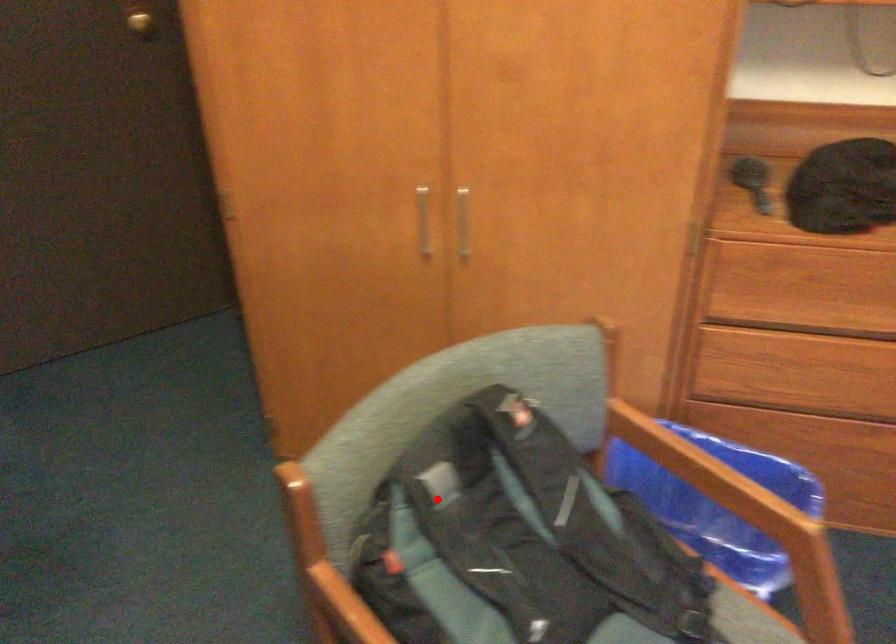
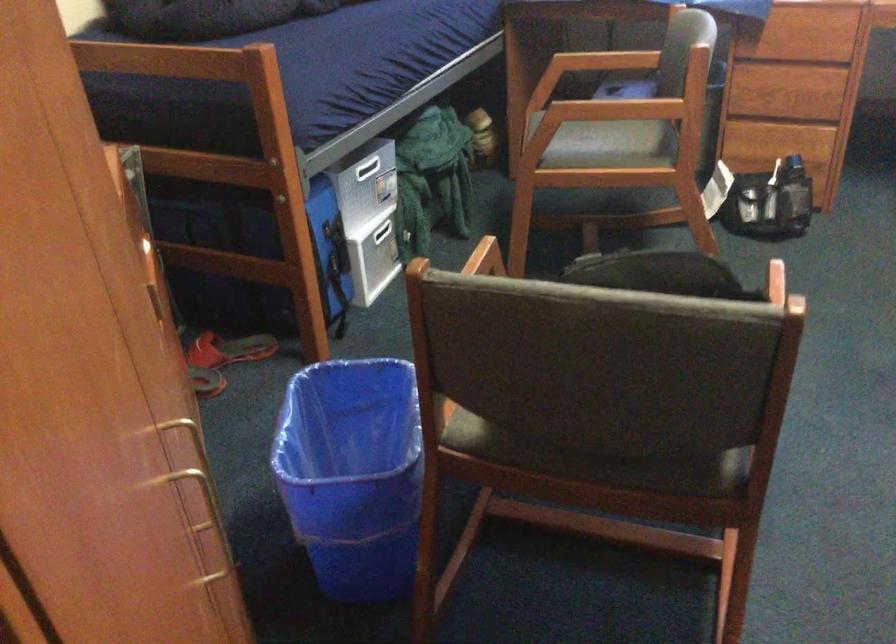
The point at the highlighted location is marked in the first image. Where is the corresponding point in the second image?

(659, 272)